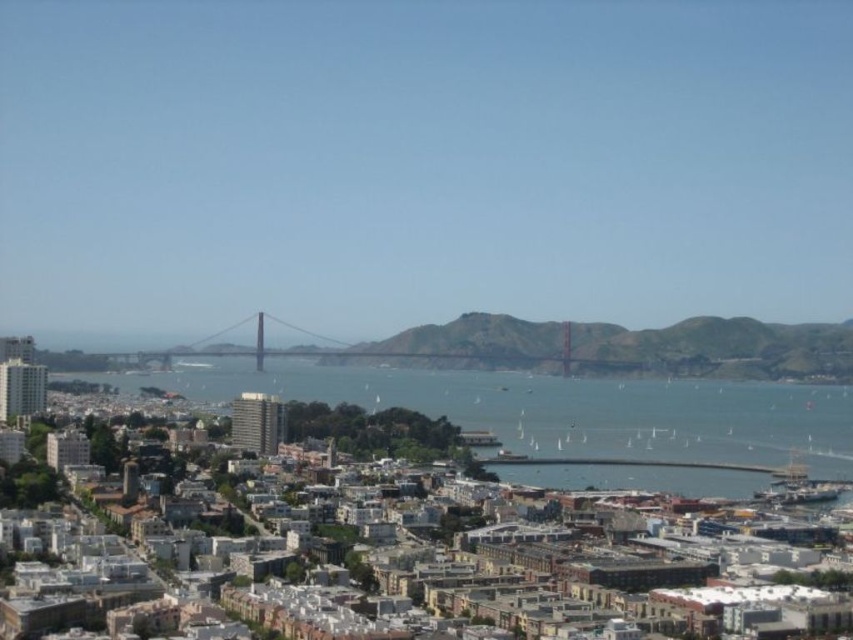
Between blue water at center and metallic bridge at center, which one appears on the left side from the viewer's perspective?

metallic bridge at center is more to the left.

Is blue water at center shorter than metallic bridge at center?

No, blue water at center is not shorter than metallic bridge at center.

Is point (556, 406) positioned behind point (569, 344)?

That is False.

I want to click on blue water at center, so click(558, 408).